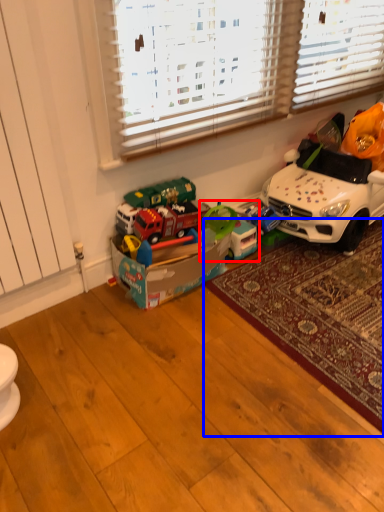
Question: Which point is closer to the camera, toy (highlighted by a red box) or mat (highlighted by a blue box)?

Choices:
 (A) toy
 (B) mat

Answer: (B)